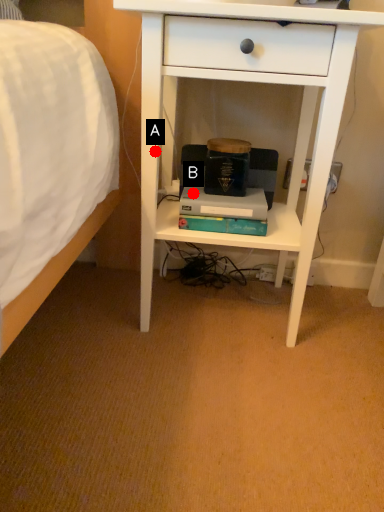
Question: Two points are circled on the image, labeled by A and B beside each circle. Which point is closer to the camera?

Choices:
 (A) A is closer
 (B) B is closer

Answer: (A)